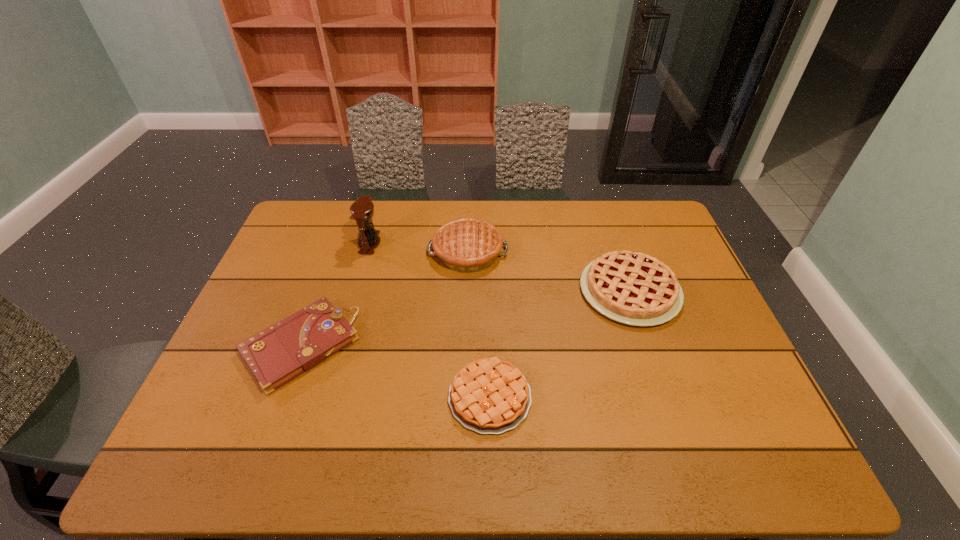
Where is `vacant space that's between the notebook and the second tallest object`? This screenshot has height=540, width=960. vacant space that's between the notebook and the second tallest object is located at coordinates (384, 299).

Locate which object is the third closest to the fourth shortest object. Please provide its 2D coordinates. Your answer should be formatted as a tuple, i.e. [(x, y)], where the tuple contains the x and y coordinates of a point satisfying the conditions above.

[(632, 288)]

Where is `object that stands as the second closest to the tallest object`? Image resolution: width=960 pixels, height=540 pixels. object that stands as the second closest to the tallest object is located at coordinates (276, 355).

At what (x,y) coordinates should I click in order to perform the action: click on the second closest pie to the shortest pie. Please return your answer as a coordinate pair (x, y). Looking at the image, I should click on (466, 245).

At what (x,y) coordinates should I click in order to perform the action: click on the second closest pie to the nearest pie. Please return your answer as a coordinate pair (x, y). Image resolution: width=960 pixels, height=540 pixels. Looking at the image, I should click on (466, 245).

The height and width of the screenshot is (540, 960). Identify the location of blank space that satisfies the following two spatial constraints: 1. on the front side of the nearest pie; 2. on the left side of the tallest object. (326, 397).

The image size is (960, 540). I want to click on free region that satisfies the following two spatial constraints: 1. on the back side of the rightmost object; 2. on the right side of the nearest pie, so click(488, 291).

This screenshot has height=540, width=960. In order to click on vacant space that satisfies the following two spatial constraints: 1. on the front side of the shortest pie; 2. on the right side of the fourth shortest object in this screenshot , I will do [464, 397].

Where is `free space in the image that satisfies the following two spatial constraints: 1. on the front side of the tallest object; 2. on the right side of the shortest pie`? Image resolution: width=960 pixels, height=540 pixels. free space in the image that satisfies the following two spatial constraints: 1. on the front side of the tallest object; 2. on the right side of the shortest pie is located at coordinates (326, 397).

Locate an element on the screen. free space that satisfies the following two spatial constraints: 1. on the front side of the tallest object; 2. on the right side of the tallest pie is located at coordinates (367, 252).